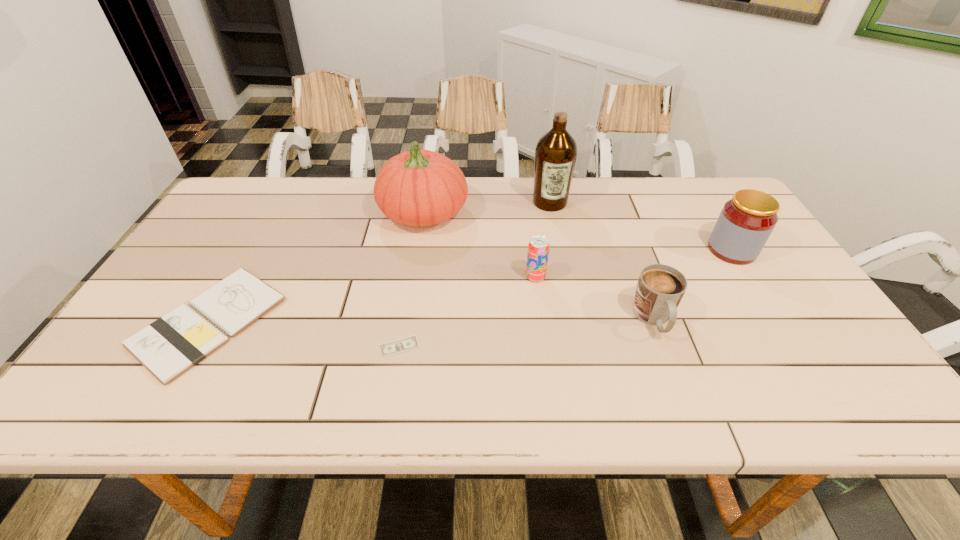
You are a GUI agent. You are given a task and a screenshot of the screen. Output one action in this format:
    pyautogui.click(x=<x>, y=<y>)
    Task: Click on the object situated at the right edge
    Image resolution: width=960 pixels, height=540 pixels.
    Given the screenshot: What is the action you would take?
    pyautogui.click(x=746, y=221)

The image size is (960, 540). Find the location of `object situated at the near left corner`. object situated at the near left corner is located at coordinates (169, 346).

In the image, there is a desktop. Identify the location of vacant space at the far edge. (487, 192).

In the image, there is a desktop. At what (x,y) coordinates should I click in order to perform the action: click on free region at the near edge. Please return your answer as a coordinate pair (x, y). Image resolution: width=960 pixels, height=540 pixels. Looking at the image, I should click on (614, 382).

The width and height of the screenshot is (960, 540). In the image, there is a desktop. What are the coordinates of `blank space at the left edge` in the screenshot? It's located at (225, 267).

Where is `vacant space at the right edge of the desktop`? This screenshot has width=960, height=540. vacant space at the right edge of the desktop is located at coordinates (755, 264).

In the image, there is a desktop. In order to click on vacant space at the far left corner in this screenshot , I will do `click(254, 178)`.

At what (x,y) coordinates should I click in order to perform the action: click on blank space at the near left corner of the desktop. Please return your answer as a coordinate pair (x, y). The height and width of the screenshot is (540, 960). Looking at the image, I should click on (147, 403).

Locate an element on the screen. This screenshot has height=540, width=960. free spot between the tallest object and the money is located at coordinates tap(474, 274).

The width and height of the screenshot is (960, 540). Find the location of `vacant area that lies between the leftmost object and the pumpkin`. vacant area that lies between the leftmost object and the pumpkin is located at coordinates (317, 267).